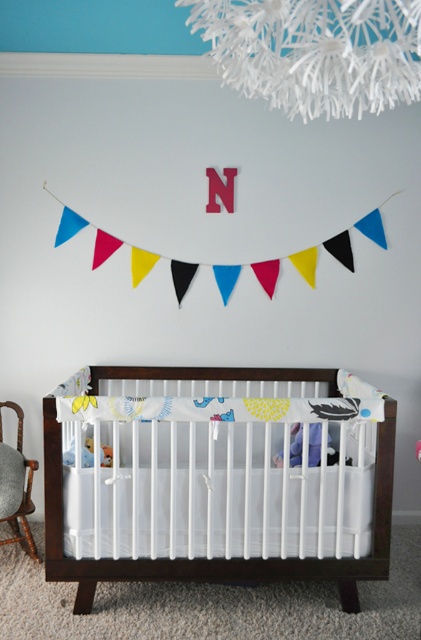
You are a parent trying to place a new stuffed animal in the nursery. The stuffed animal is the same size as the plush yellow bear at center. Will the white wood crib at center have enough space to accommodate the new stuffed animal without removing any existing toys?

The white wood crib at center is wider than the plush yellow bear at center, so there should be enough space to add the new stuffed animal without removing existing toys.